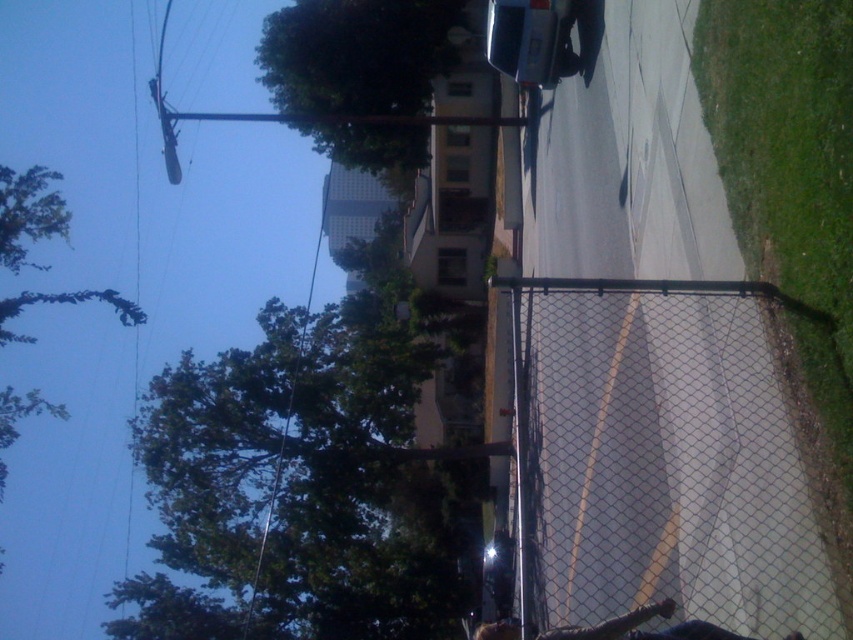
You are standing on the sidewalk and want to take a photo of the green leafy tree at center and the metallic wire at upper left. Which object should you focus on first if you want both to be in sharp focus?

The green leafy tree at center is closer to the viewer than the metallic wire at upper left. To have both in sharp focus, focus on the green leafy tree at center since it is the closer object.

You are a photographer trying to capture the green leafy tree at upper left and metallic wire at upper left in your shot. Based on their sizes in the image, which object would appear smaller in your photo?

The green leafy tree at upper left appears smaller in the photo compared to the metallic wire at upper left.